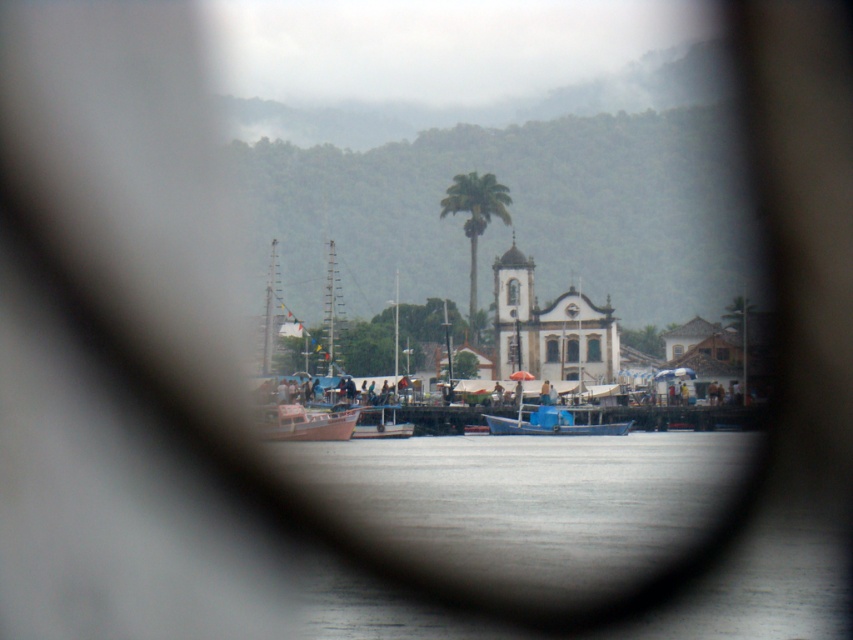
You are a delivery drone that needs to fly from the green leafy palm tree at center to the white matte boat at center. The drone has a maximum flight range of 25 meters. Can it make the trip without needing to recharge?

The distance between the green leafy palm tree at center and the white matte boat at center is 26.24 meters, which exceeds the drone s 25 meter range. The drone cannot complete the trip without recharging.

You are standing on the pier and want to board a boat. You see the blue matte boat at center and the white matte boat at center. Which one is shorter and easier to climb onto?

The blue matte boat at center is shorter than the white matte boat at center, so it would be easier to climb onto.